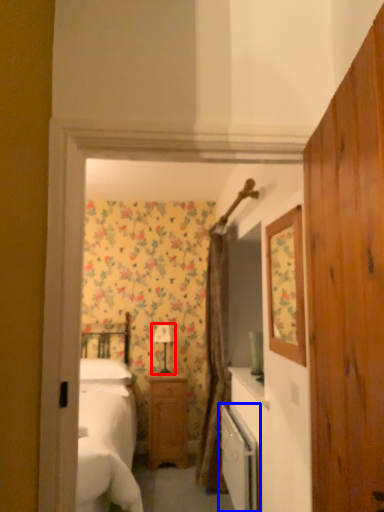
Question: Which point is closer to the camera, lamp (highlighted by a red box) or dish washer (highlighted by a blue box)?

Choices:
 (A) lamp
 (B) dish washer

Answer: (B)